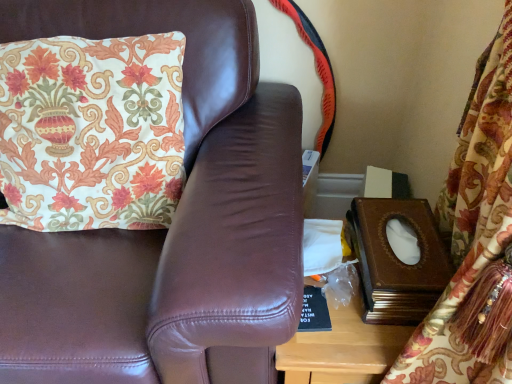
Question: Is brown leather couch at upper left wider or thinner than floral fabric cushion at upper left?

Choices:
 (A) wide
 (B) thin

Answer: (A)

Question: Is brown leather couch at upper left bigger or smaller than floral fabric cushion at upper left?

Choices:
 (A) big
 (B) small

Answer: (A)

Question: Considering their positions, is brown leather couch at upper left located in front of or behind floral fabric cushion at upper left?

Choices:
 (A) behind
 (B) front

Answer: (B)

Question: Is floral fabric cushion at upper left spatially inside brown leather couch at upper left, or outside of it?

Choices:
 (A) inside
 (B) outside

Answer: (A)

Question: Is floral fabric cushion at upper left to the left or to the right of brown leather couch at upper left in the image?

Choices:
 (A) left
 (B) right

Answer: (B)

Question: From the image's perspective, is floral fabric cushion at upper left located above or below brown leather couch at upper left?

Choices:
 (A) below
 (B) above

Answer: (B)

Question: Is floral fabric cushion at upper left in front of or behind brown leather couch at upper left in the image?

Choices:
 (A) behind
 (B) front

Answer: (A)